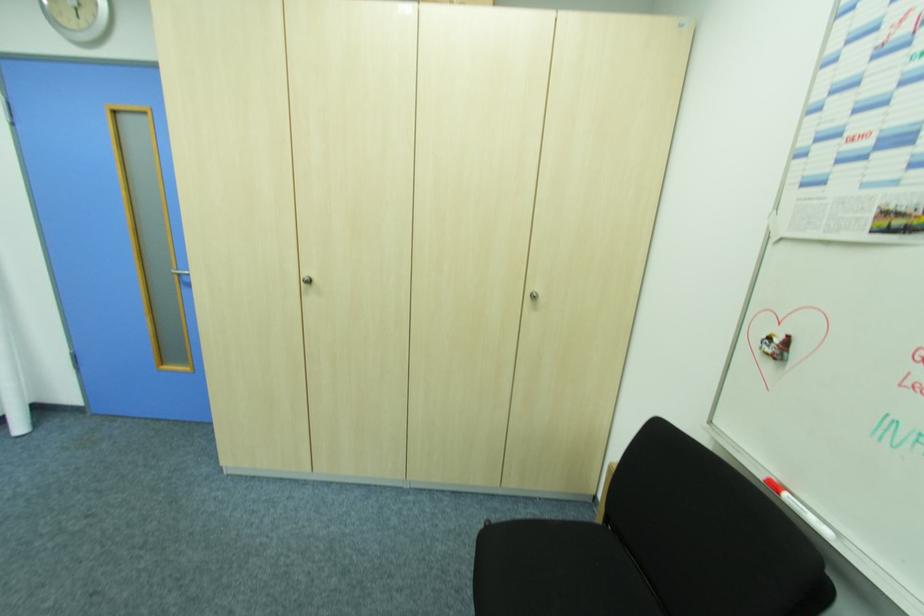
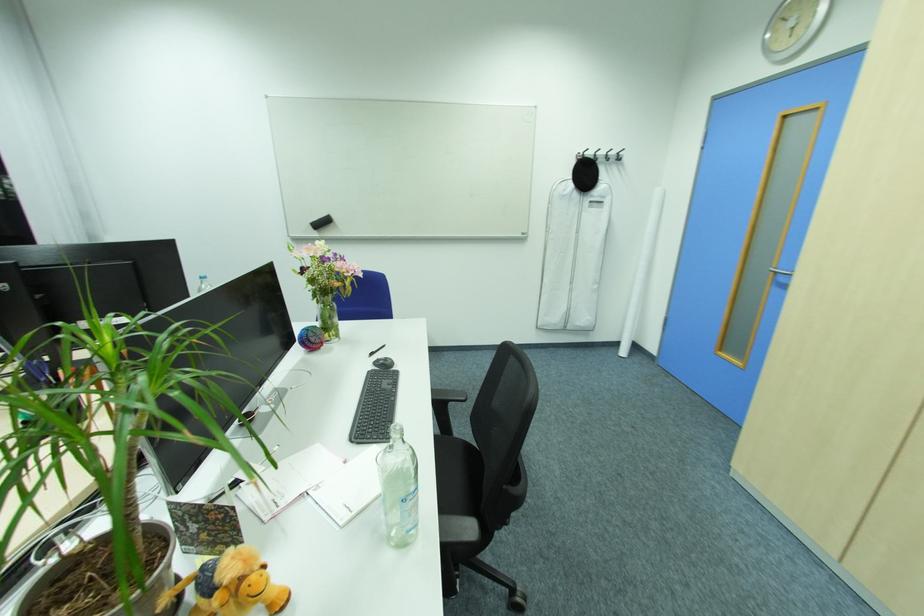
Question: The images are taken continuously from a first-person perspective. In which direction is your viewpoint rotating?

Choices:
 (A) Left
 (B) Right
 (C) Up
 (D) Down

Answer: (A)